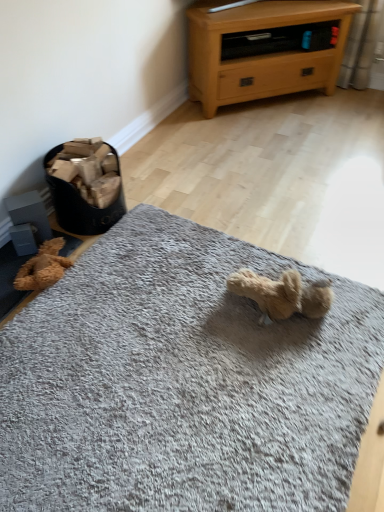
Question: Would you say light oak wood chest of drawers at upper right is a long distance from brown plush teddy bear at lower left?

Choices:
 (A) no
 (B) yes

Answer: (B)

Question: Is light oak wood chest of drawers at upper right taller than brown plush teddy bear at lower left?

Choices:
 (A) no
 (B) yes

Answer: (B)

Question: From the image's perspective, does light oak wood chest of drawers at upper right appear lower than brown plush teddy bear at lower left?

Choices:
 (A) no
 (B) yes

Answer: (A)

Question: From a real-world perspective, is light oak wood chest of drawers at upper right below brown plush teddy bear at lower left?

Choices:
 (A) no
 (B) yes

Answer: (A)

Question: Is light oak wood chest of drawers at upper right positioned in front of brown plush teddy bear at lower left?

Choices:
 (A) yes
 (B) no

Answer: (B)

Question: Does light oak wood chest of drawers at upper right have a larger size compared to brown plush teddy bear at lower left?

Choices:
 (A) yes
 (B) no

Answer: (A)

Question: Is the depth of gray soft rug at center greater than that of brown plush teddy bear at lower left?

Choices:
 (A) yes
 (B) no

Answer: (B)

Question: Is gray soft rug at center thinner than brown plush teddy bear at lower left?

Choices:
 (A) no
 (B) yes

Answer: (A)

Question: Is gray soft rug at center shorter than brown plush teddy bear at lower left?

Choices:
 (A) no
 (B) yes

Answer: (B)

Question: Can you confirm if gray soft rug at center is wider than brown plush teddy bear at lower left?

Choices:
 (A) yes
 (B) no

Answer: (A)

Question: From a real-world perspective, is gray soft rug at center beneath brown plush teddy bear at lower left?

Choices:
 (A) yes
 (B) no

Answer: (A)

Question: Can you confirm if gray soft rug at center is positioned to the left of brown plush teddy bear at lower left?

Choices:
 (A) yes
 (B) no

Answer: (B)

Question: Considering the relative sizes of light oak wood chest of drawers at upper right and gray soft rug at center in the image provided, is light oak wood chest of drawers at upper right wider than gray soft rug at center?

Choices:
 (A) yes
 (B) no

Answer: (B)